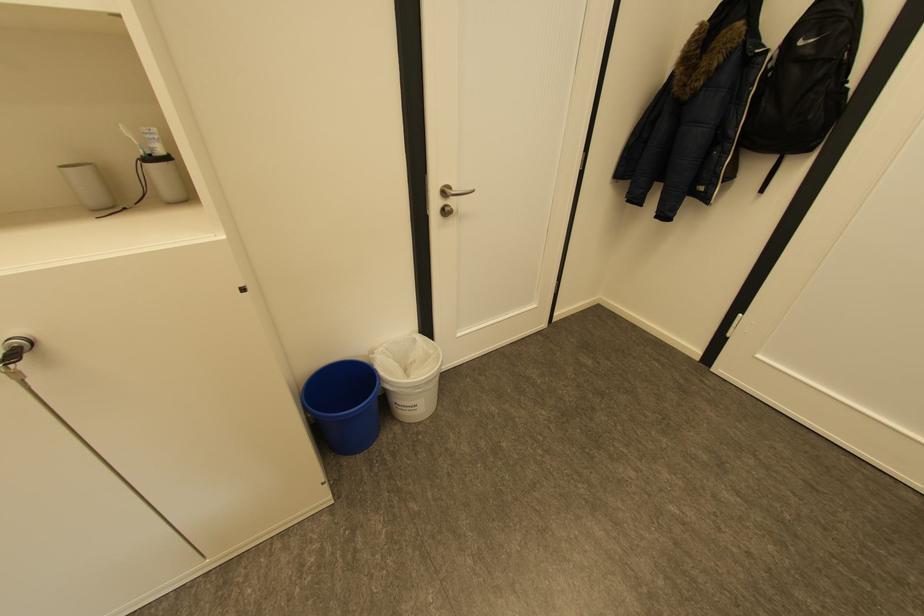
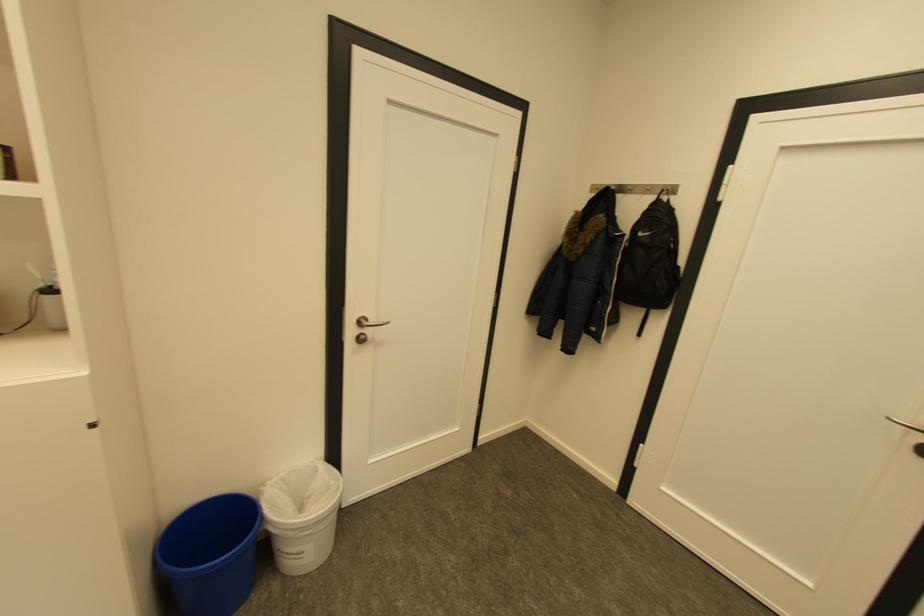
Question: How did the camera likely rotate?

Choices:
 (A) Left
 (B) Right
 (C) Up
 (D) Down

Answer: (C)